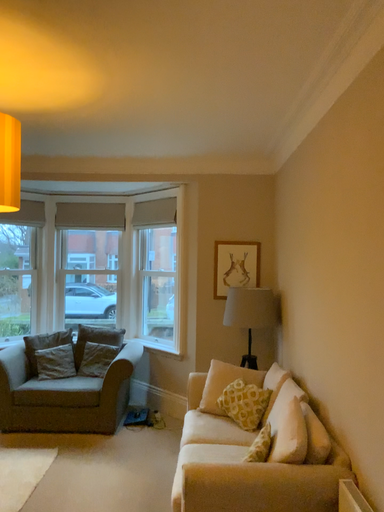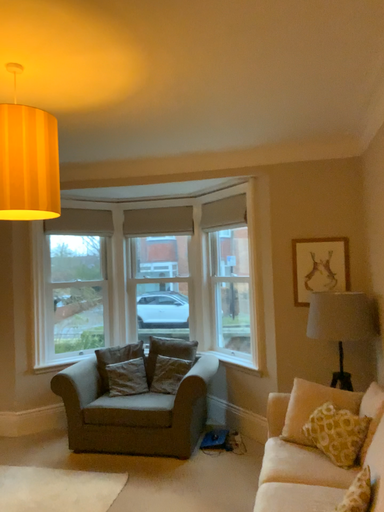
Question: How did the camera likely rotate when shooting the video?

Choices:
 (A) rotated left
 (B) rotated right

Answer: (A)